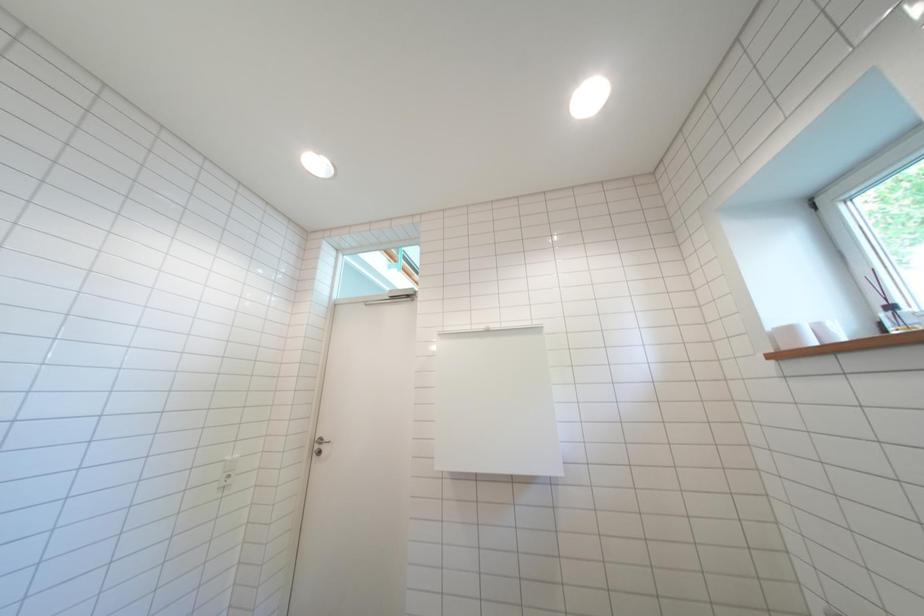
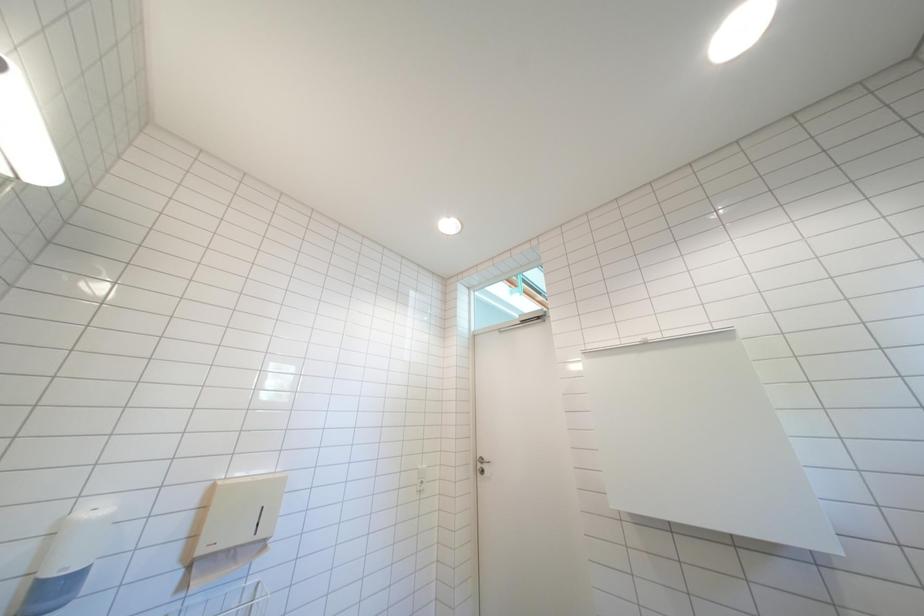
Question: The first image is from the beginning of the video and the second image is from the end. How did the camera likely rotate when shooting the video?

Choices:
 (A) Left
 (B) Right
 (C) Up
 (D) Down

Answer: (A)